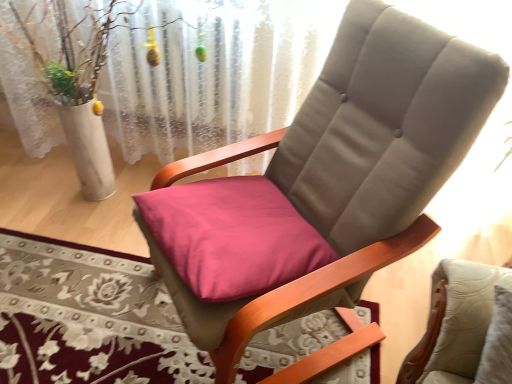
Question: Is suede-like beige chair at center at the left side of white lace curtain at upper center?

Choices:
 (A) yes
 (B) no

Answer: (B)

Question: Considering the relative sizes of suede-like beige chair at center and white lace curtain at upper center in the image provided, is suede-like beige chair at center smaller than white lace curtain at upper center?

Choices:
 (A) yes
 (B) no

Answer: (B)

Question: From the image's perspective, is suede-like beige chair at center over white lace curtain at upper center?

Choices:
 (A) no
 (B) yes

Answer: (A)

Question: From the image's perspective, is suede-like beige chair at center below white lace curtain at upper center?

Choices:
 (A) yes
 (B) no

Answer: (A)

Question: Does suede-like beige chair at center have a lesser height compared to white lace curtain at upper center?

Choices:
 (A) no
 (B) yes

Answer: (B)

Question: From a real-world perspective, is suede-like beige chair at center positioned under white lace curtain at upper center based on gravity?

Choices:
 (A) yes
 (B) no

Answer: (A)

Question: Is white lace curtain at upper center positioned far away from pink fabric cushion at center?

Choices:
 (A) no
 (B) yes

Answer: (A)

Question: Is white lace curtain at upper center oriented towards pink fabric cushion at center?

Choices:
 (A) yes
 (B) no

Answer: (B)

Question: Is white lace curtain at upper center placed right next to pink fabric cushion at center?

Choices:
 (A) yes
 (B) no

Answer: (B)

Question: Does white lace curtain at upper center appear on the left side of pink fabric cushion at center?

Choices:
 (A) yes
 (B) no

Answer: (A)

Question: Considering the relative sizes of white lace curtain at upper center and pink fabric cushion at center in the image provided, is white lace curtain at upper center taller than pink fabric cushion at center?

Choices:
 (A) yes
 (B) no

Answer: (A)

Question: Can you confirm if white lace curtain at upper center is bigger than pink fabric cushion at center?

Choices:
 (A) yes
 (B) no

Answer: (A)

Question: Is the surface of pink fabric cushion at center in direct contact with suede-like beige chair at center?

Choices:
 (A) yes
 (B) no

Answer: (B)